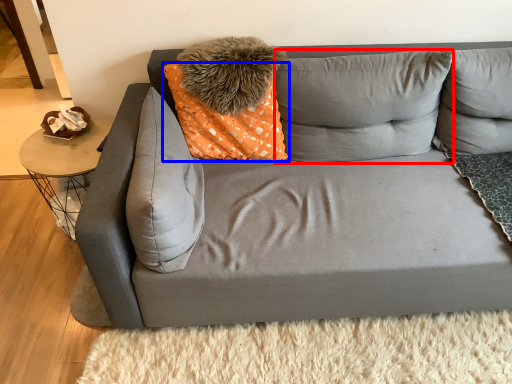
Question: Which point is further to the camera, pillow (highlighted by a red box) or pillow (highlighted by a blue box)?

Choices:
 (A) pillow
 (B) pillow

Answer: (A)